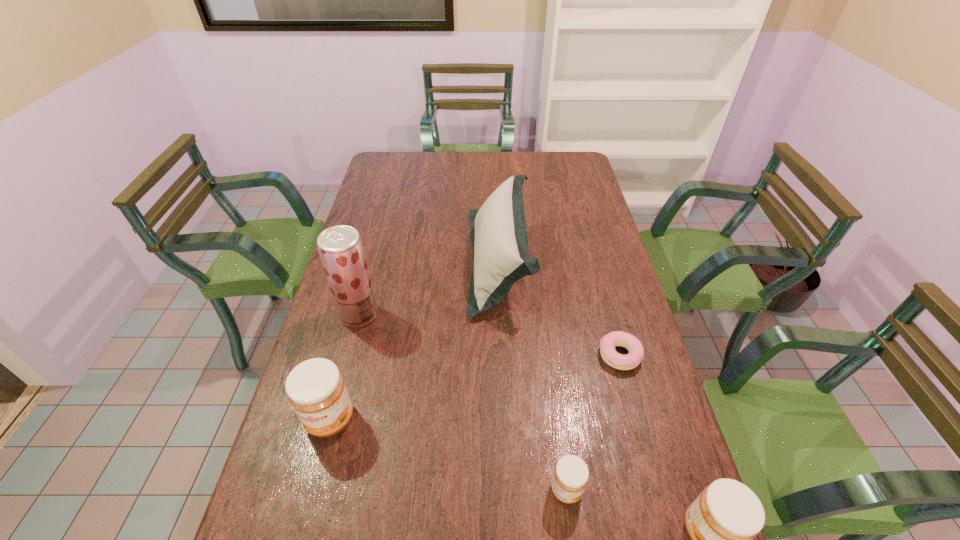
Image resolution: width=960 pixels, height=540 pixels. Find the location of `vacant space at the near edge`. vacant space at the near edge is located at coordinates (516, 523).

This screenshot has width=960, height=540. I want to click on vacant space at the left edge of the desktop, so click(x=379, y=233).

In the image, there is a desktop. At what (x,y) coordinates should I click in order to perform the action: click on vacant space at the right edge. Please return your answer as a coordinate pair (x, y). Looking at the image, I should click on (667, 437).

This screenshot has width=960, height=540. I want to click on empty space between the cushion and the shortest object, so click(560, 308).

Where is `free spot between the doughnut and the fruit juice`? The width and height of the screenshot is (960, 540). free spot between the doughnut and the fruit juice is located at coordinates 490,335.

Identify the location of vacant area that lies between the leftmost jam and the fourth nearest object. The image size is (960, 540). (475, 387).

You are a GUI agent. You are given a task and a screenshot of the screen. Output one action in this format:
    pyautogui.click(x=<x>, y=<y>)
    Task: Click on the free space between the farthest jam and the shortest jam
    The width and height of the screenshot is (960, 540).
    Given the screenshot: What is the action you would take?
    pyautogui.click(x=448, y=454)

In order to click on unoccupied area between the fifth tallest object and the shortest object in this screenshot , I will do `click(593, 422)`.

Where is `object that ranks as the third closest to the tallest object`? The height and width of the screenshot is (540, 960). object that ranks as the third closest to the tallest object is located at coordinates (570, 477).

The width and height of the screenshot is (960, 540). In order to click on object that ranks as the second closest to the shortest jam in this screenshot , I will do `click(608, 343)`.